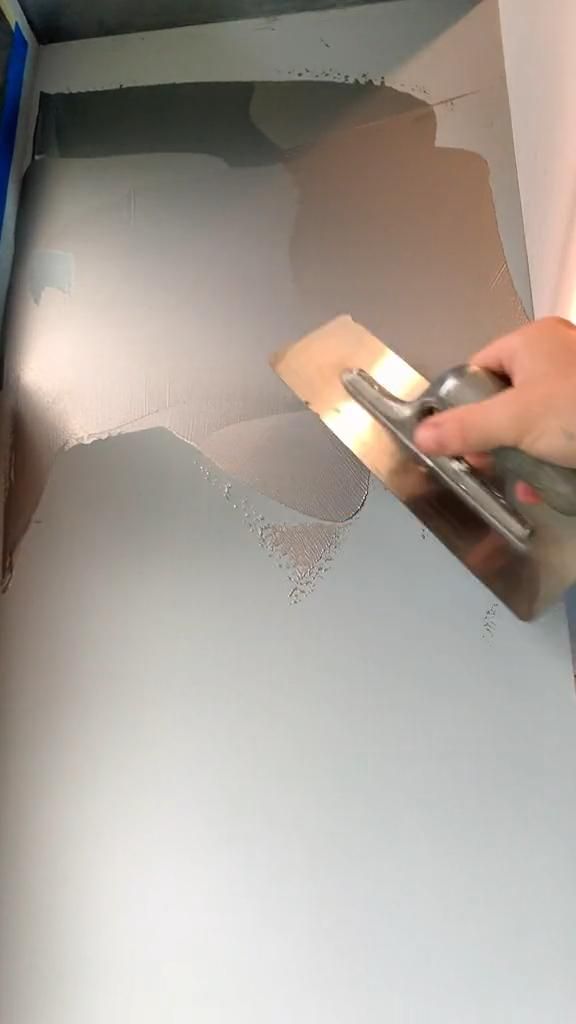
The width and height of the screenshot is (576, 1024). Find the location of `strip of blue painter's tape`. strip of blue painter's tape is located at coordinates (20, 57), (10, 146).